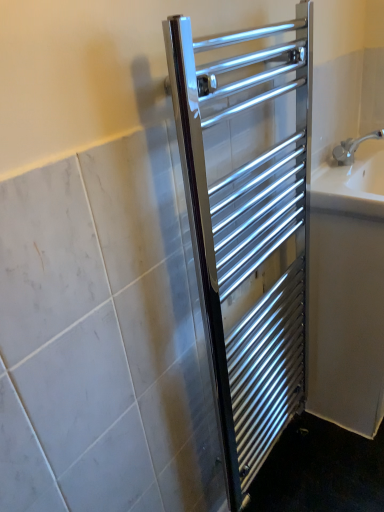
Question: From a real-world perspective, is polished chrome towel rack at center physically located above or below white glossy bath at right?

Choices:
 (A) below
 (B) above

Answer: (B)

Question: Does point (284, 234) appear closer or farther from the camera than point (344, 375)?

Choices:
 (A) farther
 (B) closer

Answer: (B)

Question: Considering the real-world distances, which object is closest to the white glossy bath at right?

Choices:
 (A) polished chrome towel rack at center
 (B) white ceramic sink at right

Answer: (B)

Question: Which object is the closest to the white glossy bath at right?

Choices:
 (A) white ceramic sink at right
 (B) polished chrome towel rack at center

Answer: (A)